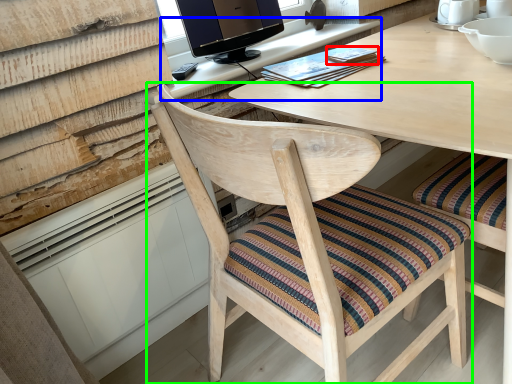
Question: Considering the real-world distances, which object is closest to book (highlighted by a red box)? computer desk (highlighted by a blue box) or chair (highlighted by a green box).

Choices:
 (A) computer desk
 (B) chair

Answer: (A)